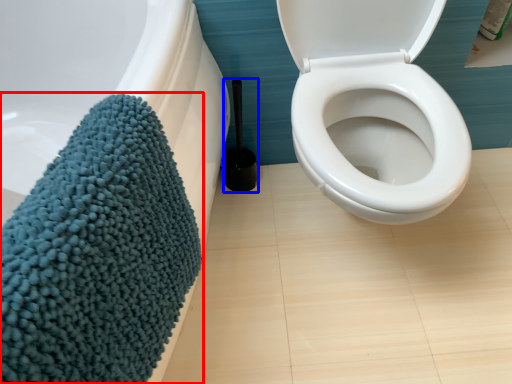
Question: Which of the following is the closest to the observer, bath towel (highlighted by a red box) or brush (highlighted by a blue box)?

Choices:
 (A) bath towel
 (B) brush

Answer: (A)